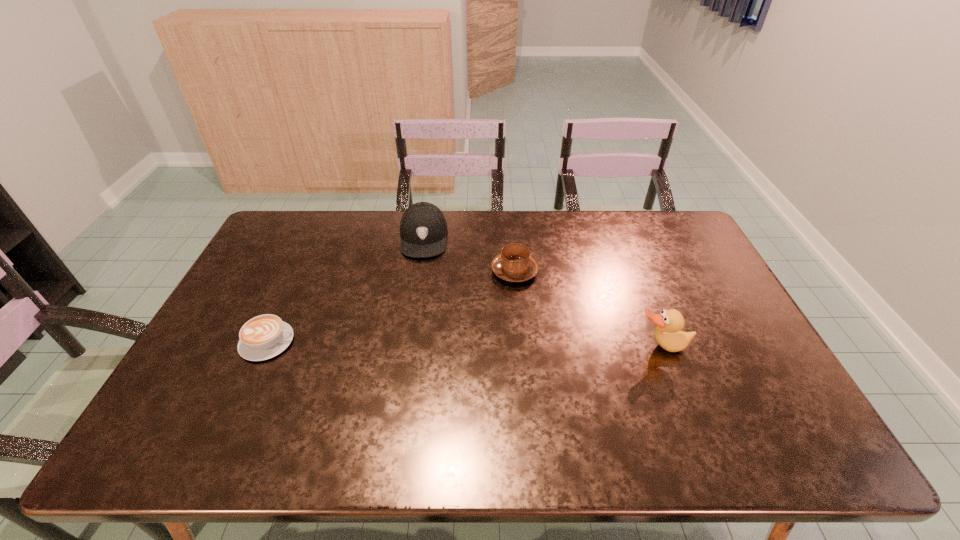
Where is `free space located on the side of the taller cappuccino with the handle`? free space located on the side of the taller cappuccino with the handle is located at coordinates (420, 334).

Where is `vacant space located on the side of the taller cappuccino with the handle`? vacant space located on the side of the taller cappuccino with the handle is located at coordinates (470, 301).

You are a GUI agent. You are given a task and a screenshot of the screen. Output one action in this format:
    pyautogui.click(x=<x>, y=<y>)
    Task: Click on the free space located 0.220m on the side of the taller cappuccino with the handle
    Image resolution: width=960 pixels, height=540 pixels.
    Given the screenshot: What is the action you would take?
    pyautogui.click(x=445, y=318)

Where is `vacant space situated on the front-facing side of the third object from right to left`? vacant space situated on the front-facing side of the third object from right to left is located at coordinates (420, 281).

This screenshot has height=540, width=960. In order to click on free space located 0.060m on the front-facing side of the third object from right to left in this screenshot , I will do `click(420, 272)`.

You are a GUI agent. You are given a task and a screenshot of the screen. Output one action in this format:
    pyautogui.click(x=<x>, y=<y>)
    Task: Click on the vacant point located 0.200m on the front-facing side of the third object from right to left
    Image resolution: width=960 pixels, height=540 pixels.
    Given the screenshot: What is the action you would take?
    pyautogui.click(x=418, y=303)

At what (x,y) coordinates should I click in order to perform the action: click on object that is at the far edge. Please return your answer as a coordinate pair (x, y). Looking at the image, I should click on pyautogui.click(x=423, y=228).

Image resolution: width=960 pixels, height=540 pixels. I want to click on object that is at the left edge, so click(265, 336).

Locate an element on the screen. Image resolution: width=960 pixels, height=540 pixels. vacant space at the far edge of the desktop is located at coordinates (531, 226).

Locate an element on the screen. Image resolution: width=960 pixels, height=540 pixels. free space at the near edge is located at coordinates (259, 403).